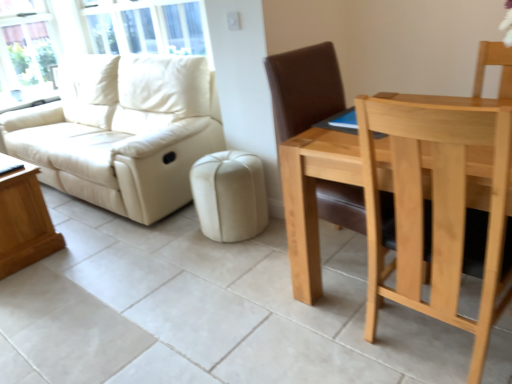
Where is `vacant region above beige leather ottoman at center (from a real-world perspective)`? This screenshot has height=384, width=512. vacant region above beige leather ottoman at center (from a real-world perspective) is located at coordinates (226, 163).